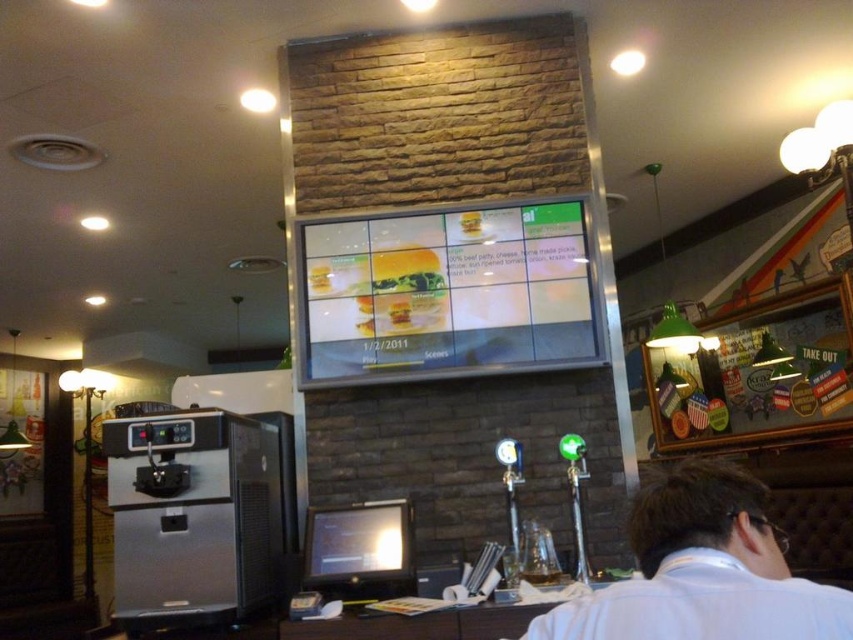
Does white shirt at lower right have a smaller size compared to golden crispy chicken at center?

Incorrect, white shirt at lower right is not smaller in size than golden crispy chicken at center.

Can you confirm if white shirt at lower right is wider than golden crispy chicken at center?

Indeed, white shirt at lower right has a greater width compared to golden crispy chicken at center.

The width and height of the screenshot is (853, 640). I want to click on white shirt at lower right, so click(703, 572).

Which is above, matte yellow cheeseburger at center or golden crispy chicken at center?

Positioned higher is matte yellow cheeseburger at center.

Based on the photo, can you confirm if matte yellow cheeseburger at center is positioned above golden crispy chicken at center?

Yes.

Image resolution: width=853 pixels, height=640 pixels. Find the location of `matte yellow cheeseburger at center`. matte yellow cheeseburger at center is located at coordinates (403, 292).

I want to click on matte yellow cheeseburger at center, so click(x=403, y=292).

The width and height of the screenshot is (853, 640). Describe the element at coordinates (703, 572) in the screenshot. I see `white shirt at lower right` at that location.

Is white shirt at lower right to the right of matte yellow cheeseburger at center from the viewer's perspective?

Indeed, white shirt at lower right is positioned on the right side of matte yellow cheeseburger at center.

Which is in front, point (663, 496) or point (386, 268)?

Point (663, 496) is in front.

Where is `white shirt at lower right`? The width and height of the screenshot is (853, 640). white shirt at lower right is located at coordinates (703, 572).